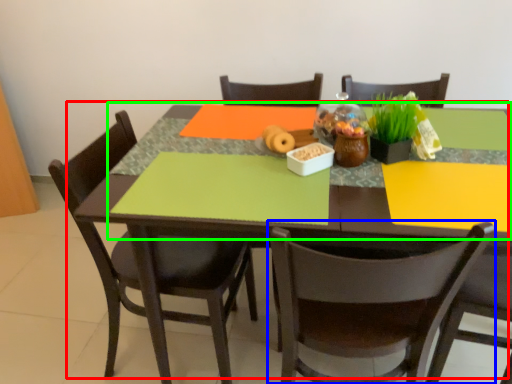
Question: Considering the real-world distances, which object is closest to table (highlighted by a red box)? chair (highlighted by a blue box) or tablecloth (highlighted by a green box).

Choices:
 (A) chair
 (B) tablecloth

Answer: (A)